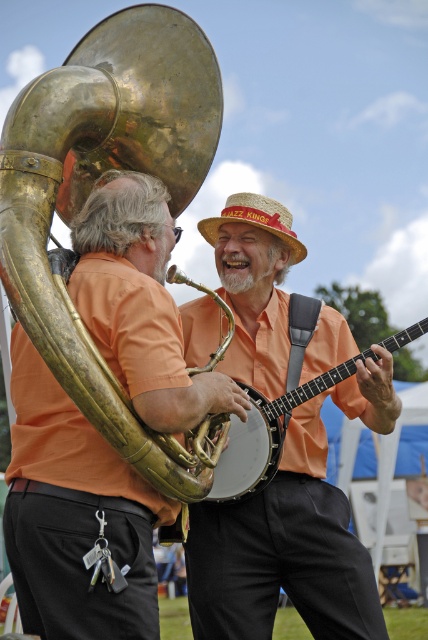
Question: Does gold brass trumpet at upper left have a larger size compared to matte gold banjo at center?

Choices:
 (A) no
 (B) yes

Answer: (B)

Question: Based on their relative distances, which object is farther from the gold brass trumpet at upper left?

Choices:
 (A) matte gold banjo at center
 (B) strawhat at center

Answer: (A)

Question: Can you confirm if matte orange shirt at center is wider than strawhat at center?

Choices:
 (A) no
 (B) yes

Answer: (B)

Question: Based on their relative distances, which object is nearer to the matte orange shirt at center?

Choices:
 (A) strawhat at center
 (B) matte gold banjo at center
 (C) gold brass trumpet at upper left

Answer: (B)

Question: Among these points, which one is farthest from the camera?

Choices:
 (A) (228, 616)
 (B) (158, 131)

Answer: (A)

Question: From the image, what is the correct spatial relationship of matte orange shirt at center in relation to matte gold banjo at center?

Choices:
 (A) above
 (B) below

Answer: (B)